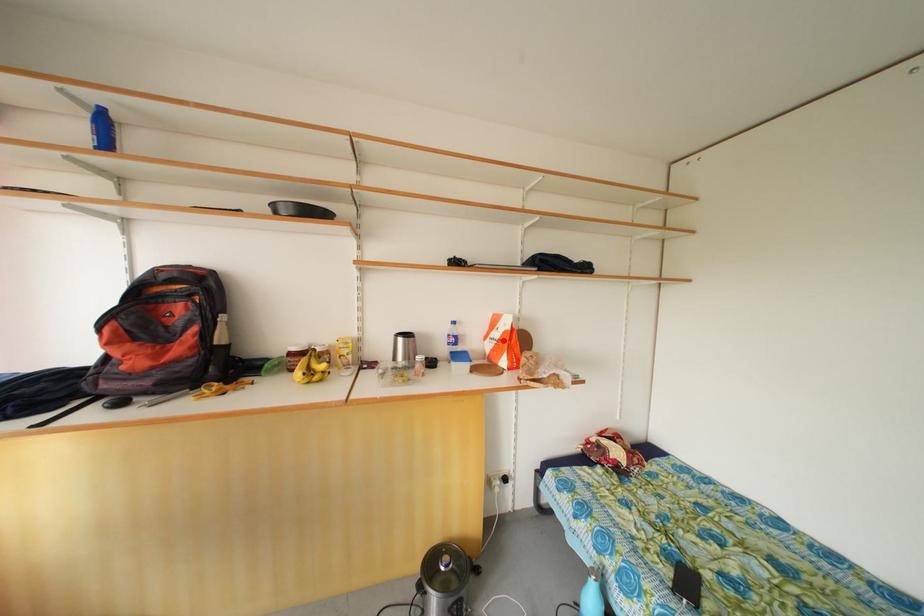
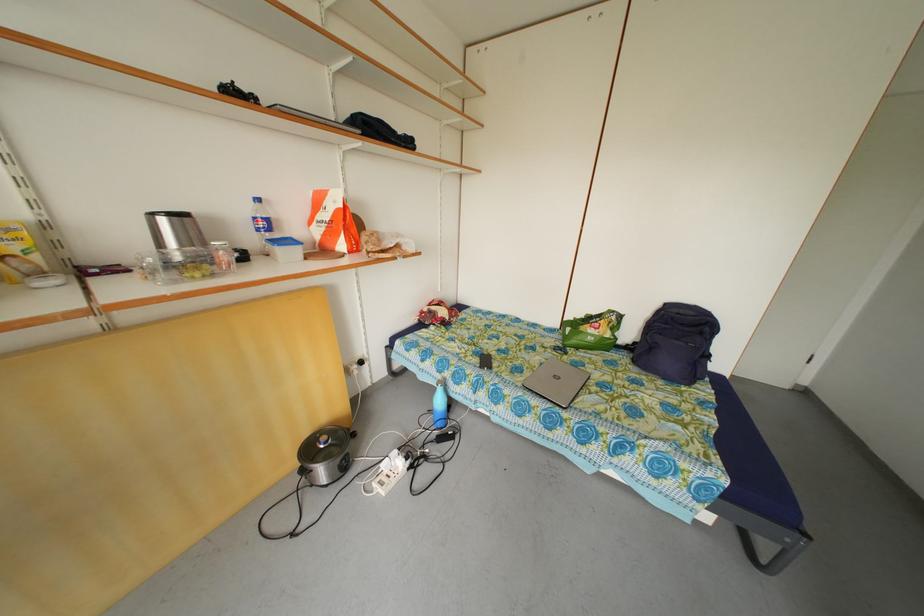
Question: I am providing you with two images of the same scene from different viewpoints. A red point is marked on the first image. At the location where the point appears in image 1, is it still visible in image 2?

Choices:
 (A) Yes
 (B) No

Answer: (A)